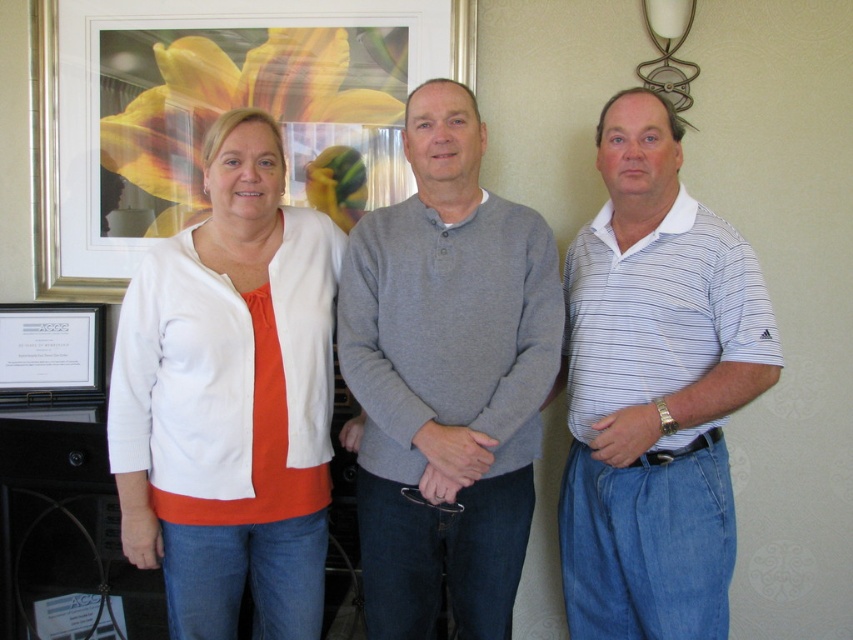
Is white matte cardigan at center bigger than gray cotton sweater at center?

Yes.

The width and height of the screenshot is (853, 640). Identify the location of white matte cardigan at center. (230, 397).

Identify the location of white matte cardigan at center. This screenshot has width=853, height=640. (230, 397).

Is the position of gray cotton sweater at center more distant than that of metallic gold picture frame at upper center?

No, gray cotton sweater at center is closer to the viewer.

Identify the location of gray cotton sweater at center. (447, 378).

Find the location of a particular element. Image resolution: width=853 pixels, height=640 pixels. gray cotton sweater at center is located at coordinates (447, 378).

Does gray cotton sweater at center have a greater height compared to white paper at left?

Yes.

Can you confirm if gray cotton sweater at center is positioned to the left of white paper at left?

In fact, gray cotton sweater at center is to the right of white paper at left.

Identify the location of gray cotton sweater at center. (447, 378).